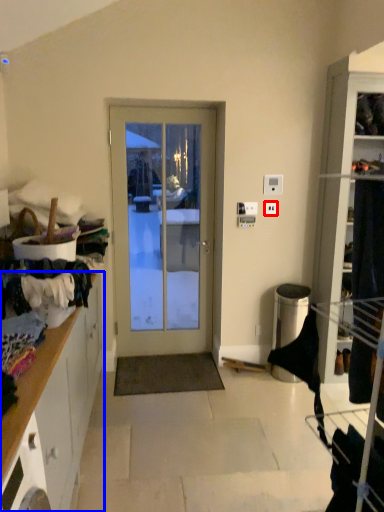
Question: Which object appears farthest to the camera in this image, electric outlet (highlighted by a red box) or cabinetry (highlighted by a blue box)?

Choices:
 (A) electric outlet
 (B) cabinetry

Answer: (A)